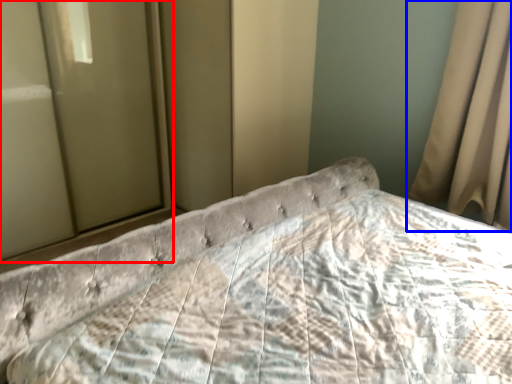
Question: Among these objects, which one is farthest to the camera, glass door (highlighted by a red box) or curtain (highlighted by a blue box)?

Choices:
 (A) glass door
 (B) curtain

Answer: (A)